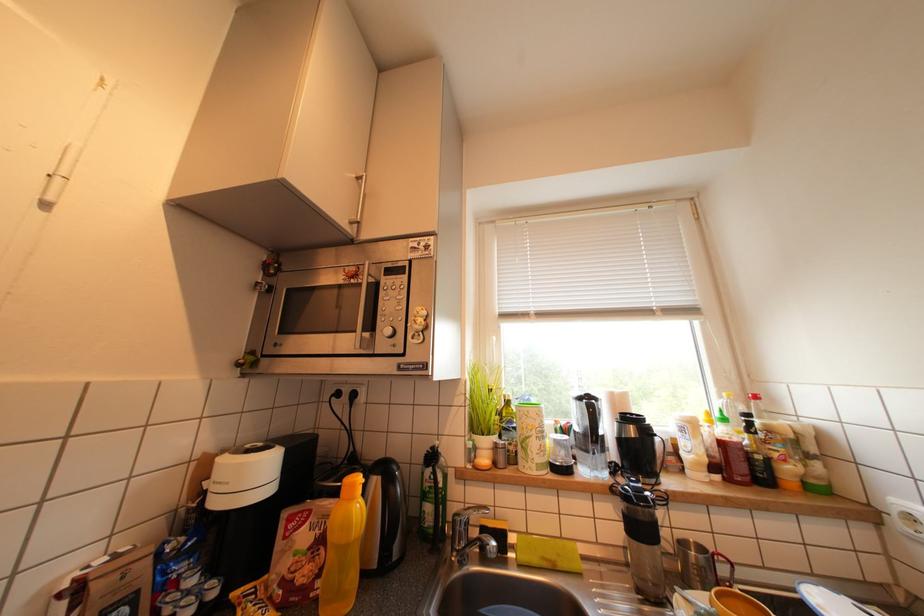
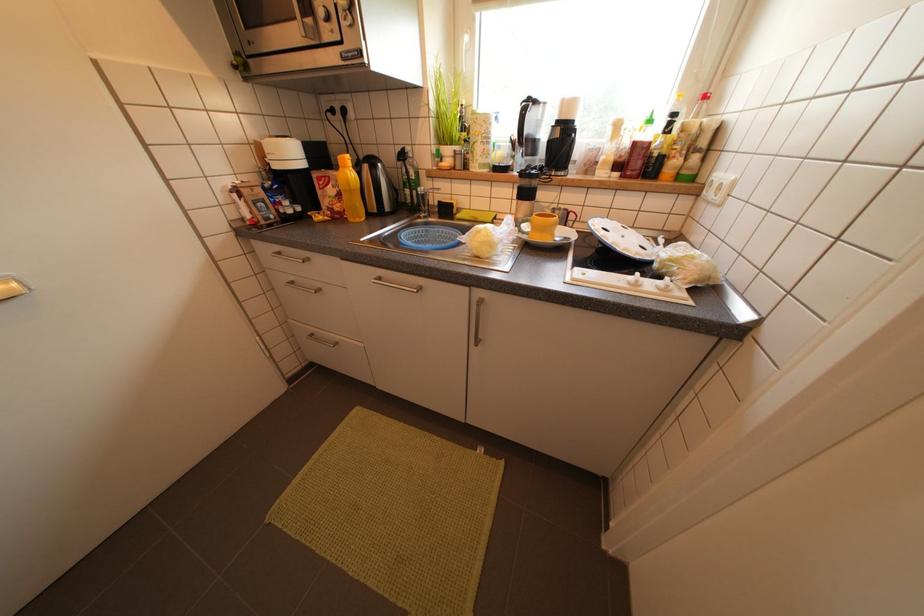
Question: The images are taken continuously from a first-person perspective. In which direction is your viewpoint rotating?

Choices:
 (A) Left
 (B) Right
 (C) Up
 (D) Down

Answer: (D)